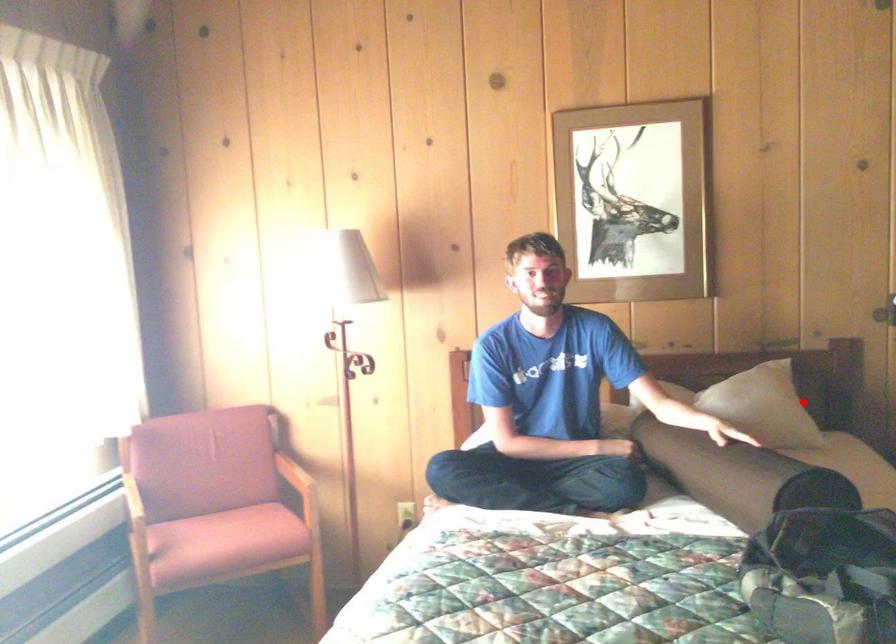
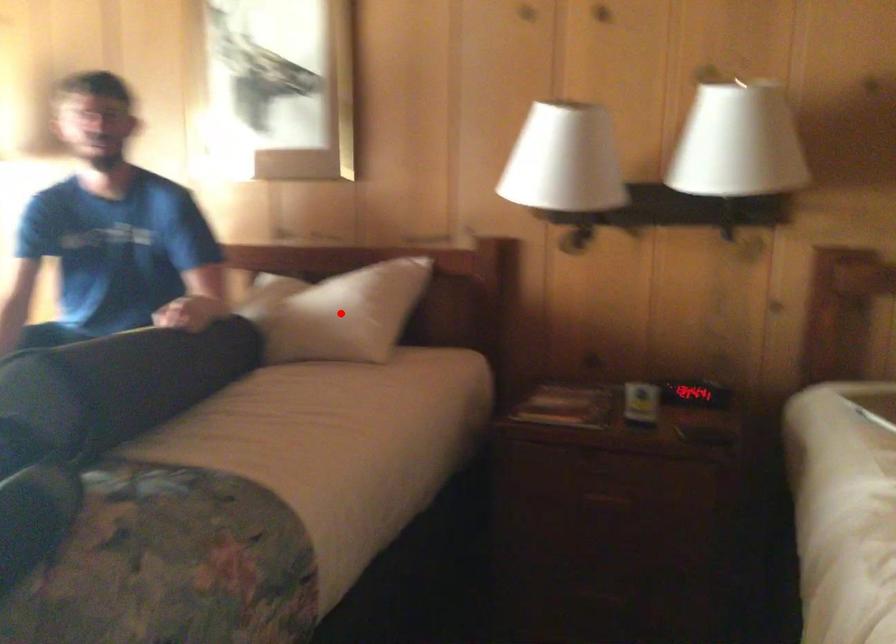
I am providing you with two images of the same scene from different viewpoints. A red point is marked on the first image and another point is marked on the second image. Do the highlighted points in image1 and image2 indicate the same real-world spot?

Yes